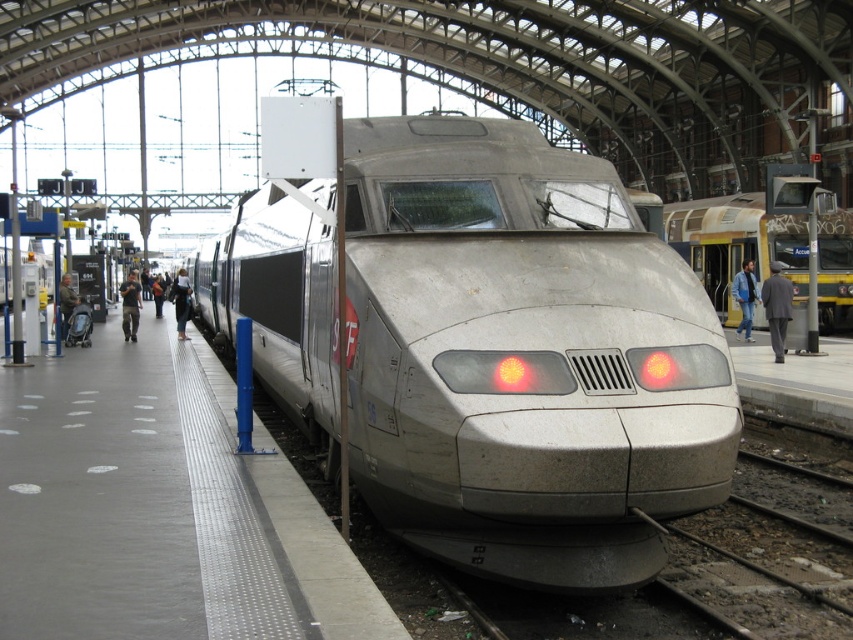
Question: Which of the following is the farthest from the observer?

Choices:
 (A) (820, 195)
 (B) (180, 284)

Answer: (B)

Question: Is silver metallic train at center to the right of dark gray pants at left from the viewer's perspective?

Choices:
 (A) no
 (B) yes

Answer: (B)

Question: Which point is closer to the camera?

Choices:
 (A) dark gray suit at left
 (B) black fabric coat at left
 (C) gray suit at right
 (D) dark gray pants at left

Answer: (C)

Question: In this image, where is smooth concrete platform at center located relative to dark gray suit at left?

Choices:
 (A) below
 (B) above

Answer: (A)

Question: Can you confirm if yellow metallic train at right is thinner than dark gray pants at left?

Choices:
 (A) no
 (B) yes

Answer: (A)

Question: Among these objects, which one is nearest to the camera?

Choices:
 (A) yellow metallic train at right
 (B) dark gray suit at left
 (C) gray suit at right

Answer: (C)